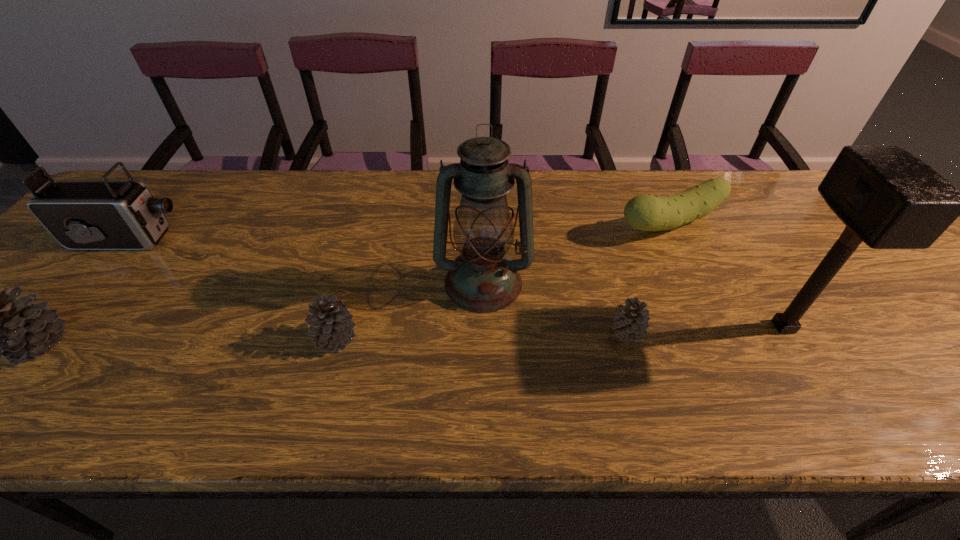
At what (x,y) coordinates should I click in order to perform the action: click on free space in the image that satisfies the following two spatial constraints: 1. on the back side of the cucumber; 2. on the left side of the third object from left to right. Please return your answer as a coordinate pair (x, y). This screenshot has height=540, width=960. Looking at the image, I should click on (367, 225).

The image size is (960, 540). What are the coordinates of `free space that satisfies the following two spatial constraints: 1. at the lens of the camcorder; 2. on the left side of the second pinecone from left to right` in the screenshot? It's located at (45, 338).

The image size is (960, 540). I want to click on vacant position in the image that satisfies the following two spatial constraints: 1. at the lens of the camcorder; 2. on the back side of the second pinecone from left to right, so coord(45,338).

Where is `vacant area in the image that satisfies the following two spatial constraints: 1. at the lens of the oil lamp; 2. on the right side of the fifth shortest object`? Image resolution: width=960 pixels, height=540 pixels. vacant area in the image that satisfies the following two spatial constraints: 1. at the lens of the oil lamp; 2. on the right side of the fifth shortest object is located at coordinates (92, 283).

This screenshot has width=960, height=540. Identify the location of free region that satisfies the following two spatial constraints: 1. at the lens of the second tallest pinecone; 2. on the right side of the fifth shortest object. (45, 338).